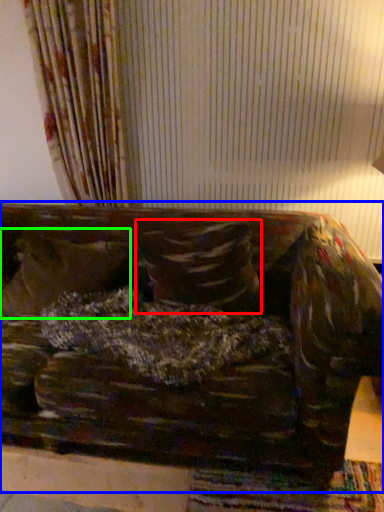
Question: Which is nearer to the pillow (highlighted by a red box)? studio couch (highlighted by a blue box) or pillow (highlighted by a green box).

Choices:
 (A) studio couch
 (B) pillow

Answer: (A)